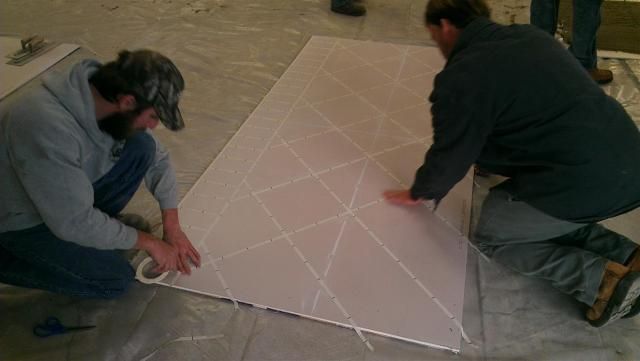
Image resolution: width=640 pixels, height=361 pixels. In order to click on drywall panel in this screenshot , I will do `click(406, 316)`.